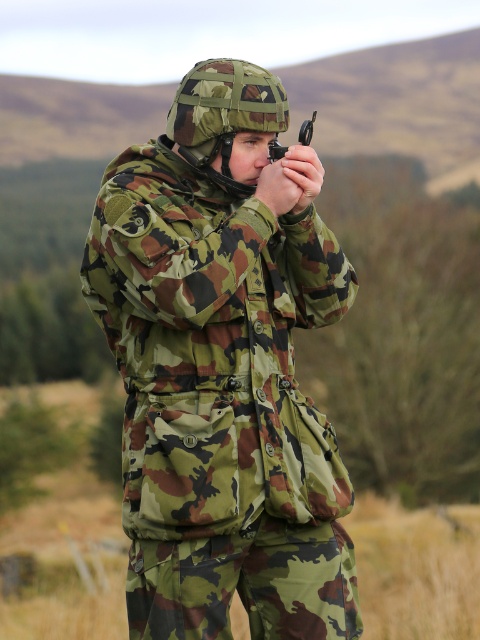
Which is more to the left, camo fabric uniform at center or matte black scope at center?

From the viewer's perspective, camo fabric uniform at center appears more on the left side.

Between camo fabric uniform at center and matte black scope at center, which one is positioned higher?

matte black scope at center is higher up.

Is point (274, 376) farther from camera compared to point (307, 141)?

No, it is not.

Identify the location of camo fabric uniform at center. Image resolution: width=480 pixels, height=640 pixels. (224, 369).